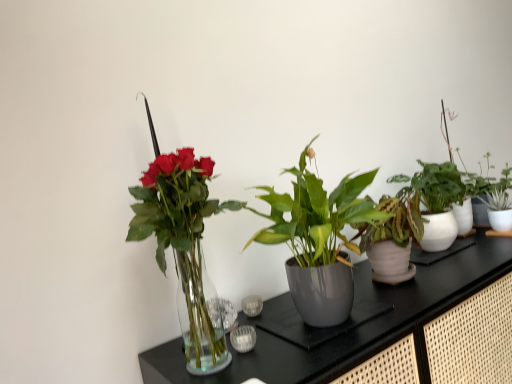
Question: From the image's perspective, does transparent glass vase at left appear lower than green glossy plant at center, placed as the fourth houseplant when sorted from right to left?

Choices:
 (A) yes
 (B) no

Answer: (A)

Question: Is transparent glass vase at left far from green glossy plant at center, placed as the fourth houseplant when sorted from right to left?

Choices:
 (A) yes
 (B) no

Answer: (B)

Question: Is transparent glass vase at left facing towards green glossy plant at center, marked as the 1th houseplant in a left-to-right arrangement?

Choices:
 (A) yes
 (B) no

Answer: (B)

Question: From the image's perspective, is transparent glass vase at left on top of green glossy plant at center, marked as the 1th houseplant in a left-to-right arrangement?

Choices:
 (A) yes
 (B) no

Answer: (B)

Question: Is transparent glass vase at left oriented away from green glossy plant at center, placed as the fourth houseplant when sorted from right to left?

Choices:
 (A) no
 (B) yes

Answer: (A)

Question: Is transparent glass vase at left shorter than green glossy plant at center, marked as the 1th houseplant in a left-to-right arrangement?

Choices:
 (A) yes
 (B) no

Answer: (B)

Question: Does white glossy pot at right, acting as the 4th houseplant starting from the left, have a larger size compared to transparent glass vase at left?

Choices:
 (A) no
 (B) yes

Answer: (A)

Question: From a real-world perspective, does white glossy pot at right, acting as the 4th houseplant starting from the left, stand above transparent glass vase at left?

Choices:
 (A) yes
 (B) no

Answer: (A)

Question: Is transparent glass vase at left inside white glossy pot at right, acting as the 4th houseplant starting from the left?

Choices:
 (A) yes
 (B) no

Answer: (B)

Question: Is white glossy pot at right, acting as the 4th houseplant starting from the left, outside transparent glass vase at left?

Choices:
 (A) yes
 (B) no

Answer: (A)

Question: From a real-world perspective, is white glossy pot at right, acting as the 4th houseplant starting from the left, beneath transparent glass vase at left?

Choices:
 (A) no
 (B) yes

Answer: (A)

Question: Can you confirm if white glossy pot at right, which is counted as the 1th houseplant, starting from the right, is shorter than transparent glass vase at left?

Choices:
 (A) no
 (B) yes

Answer: (B)

Question: Considering the relative positions of green glossy plant at center, marked as the 1th houseplant in a left-to-right arrangement, and white glossy pot at right, acting as the 4th houseplant starting from the left, in the image provided, is green glossy plant at center, marked as the 1th houseplant in a left-to-right arrangement, behind white glossy pot at right, acting as the 4th houseplant starting from the left,?

Choices:
 (A) yes
 (B) no

Answer: (B)